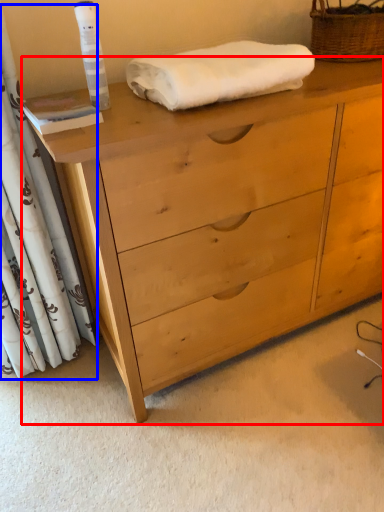
Question: Which point is further to the camera, chest of drawers (highlighted by a red box) or curtain (highlighted by a blue box)?

Choices:
 (A) chest of drawers
 (B) curtain

Answer: (B)